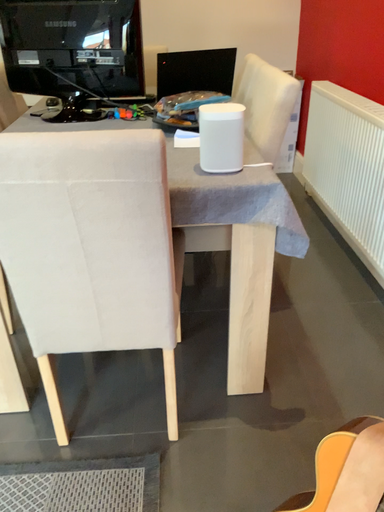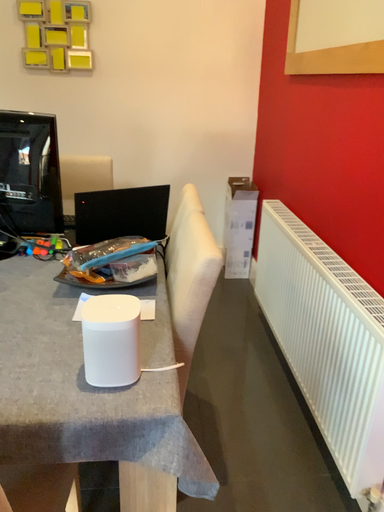
Question: Which way did the camera rotate in the video?

Choices:
 (A) rotated downward
 (B) rotated upward

Answer: (B)